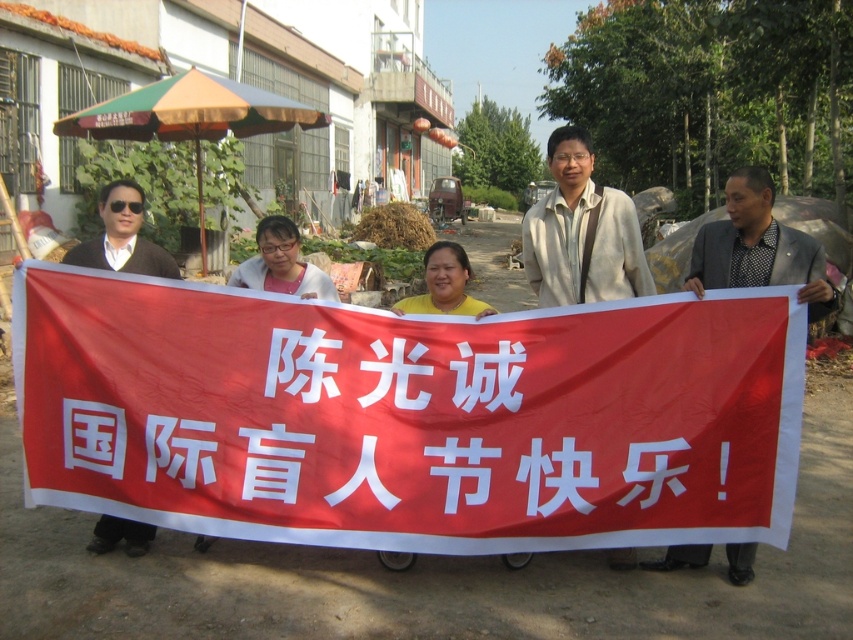
Does point (566, 234) lie in front of point (462, 269)?

That is True.

Is matte beige jacket at center bigger than yellow matte shirt at center?

Yes, matte beige jacket at center is bigger than yellow matte shirt at center.

Is point (578, 294) closer to camera compared to point (492, 310)?

No, it is not.

This screenshot has width=853, height=640. What are the coordinates of `matte beige jacket at center` in the screenshot? It's located at [581, 232].

Based on the photo, who is positioned more to the left, beige fabric shirt at center or matte black shirt at left?

matte black shirt at left

Can you confirm if beige fabric shirt at center is positioned above matte black shirt at left?

Yes, beige fabric shirt at center is above matte black shirt at left.

Image resolution: width=853 pixels, height=640 pixels. In order to click on beige fabric shirt at center in this screenshot , I will do 581,232.

Where is `beige fabric shirt at center`? This screenshot has width=853, height=640. beige fabric shirt at center is located at coordinates (581, 232).

Can you confirm if beige fabric shirt at center is shorter than matte white shirt at center?

No, beige fabric shirt at center is not shorter than matte white shirt at center.

Between point (604, 218) and point (274, 227), which one is positioned behind?

Point (274, 227)

In the scene shown: Who is more distant from viewer, (601,211) or (271,284)?

The point (271,284) is behind.

Locate an element on the screen. This screenshot has width=853, height=640. beige fabric shirt at center is located at coordinates (581, 232).